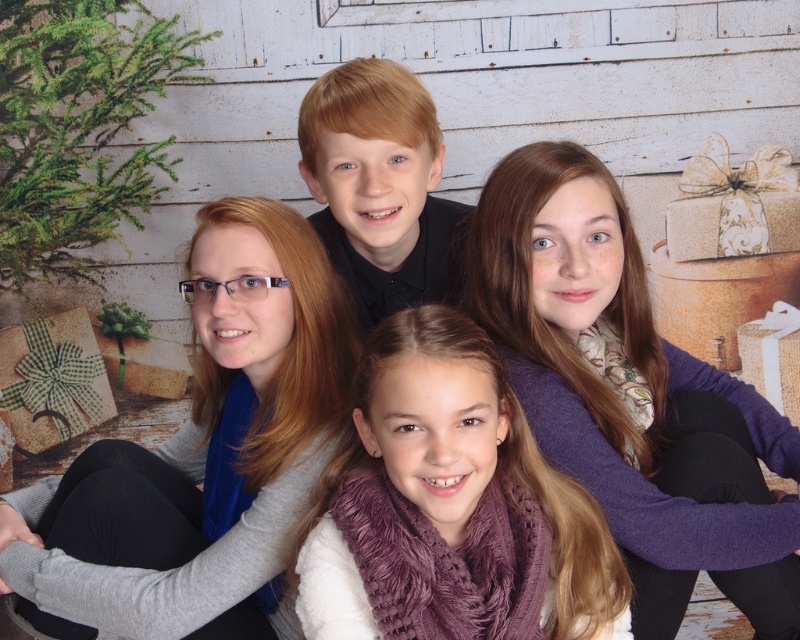
Question: Which of the following is the closest to the observer?

Choices:
 (A) (66, 488)
 (B) (381, 243)
 (C) (344, 470)

Answer: (C)

Question: Is purple knit scarf at upper right further to camera compared to blonde hair at center?

Choices:
 (A) yes
 (B) no

Answer: (B)

Question: Which object is farther from the camera taking this photo?

Choices:
 (A) gray wool scarf at upper left
 (B) blonde hair at center
 (C) purple knit scarf at upper right
 (D) purple fuzzy scarf at center

Answer: (B)

Question: Is purple fuzzy scarf at center to the left of blonde hair at center from the viewer's perspective?

Choices:
 (A) yes
 (B) no

Answer: (B)

Question: Is gray wool scarf at upper left positioned behind blonde hair at center?

Choices:
 (A) no
 (B) yes

Answer: (A)

Question: Which point is farther to the camera?

Choices:
 (A) (562, 522)
 (B) (328, 100)

Answer: (B)